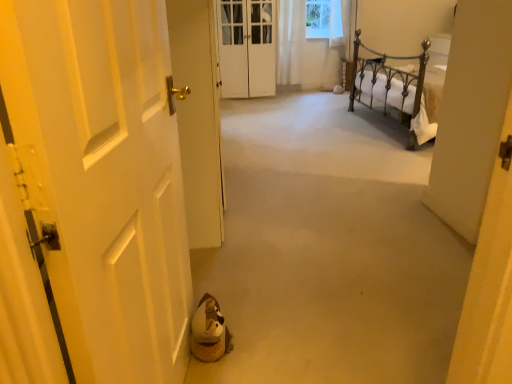
In order to click on vacant area that is in front of white wooden door at center, acting as the first door starting from the back in this screenshot , I will do `click(254, 107)`.